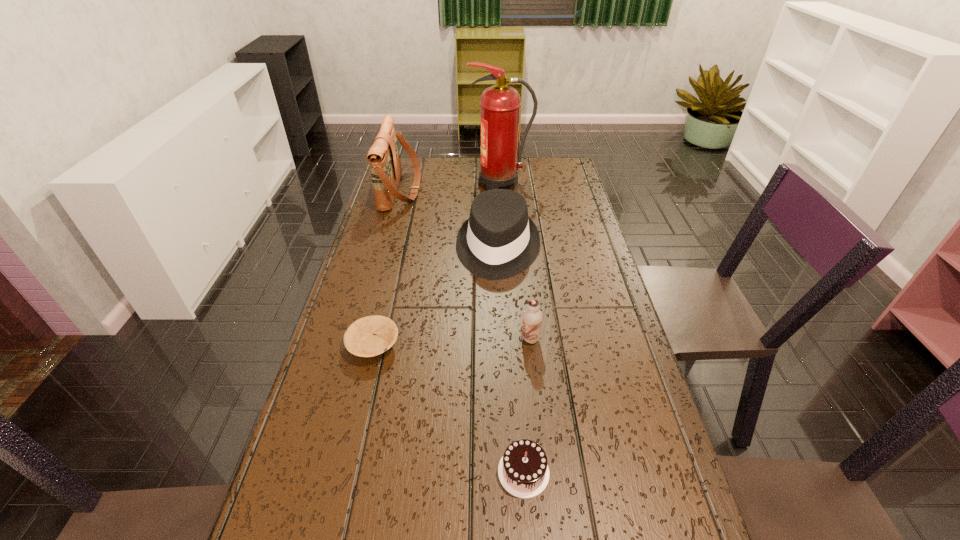
Identify the location of vacant area between the fourth shortest object and the shoulder bag. (449, 219).

Select which object is the closest to the third shortest object. Please provide its 2D coordinates. Your answer should be formatted as a tuple, i.e. [(x, y)], where the tuple contains the x and y coordinates of a point satisfying the conditions above.

[(498, 241)]

Select which object is the closest to the fourth nearest object. Please provide its 2D coordinates. Your answer should be formatted as a tuple, i.e. [(x, y)], where the tuple contains the x and y coordinates of a point satisfying the conditions above.

[(384, 158)]

At what (x,y) coordinates should I click in order to perform the action: click on free space that satisfies the following two spatial constraints: 1. on the front-facing side of the fifth shortest object; 2. on the left side of the fifth tallest object. Please return your answer as a coordinate pair (x, y). Looking at the image, I should click on (325, 472).

The image size is (960, 540). In order to click on free space that satisfies the following two spatial constraints: 1. on the back side of the fedora; 2. on the left side of the bowl in this screenshot , I will do `click(396, 248)`.

The height and width of the screenshot is (540, 960). Find the location of `free space that satisfies the following two spatial constraints: 1. on the back side of the bowl; 2. on the left side of the fourth tallest object`. free space that satisfies the following two spatial constraints: 1. on the back side of the bowl; 2. on the left side of the fourth tallest object is located at coordinates (374, 339).

In order to click on free location that satisfies the following two spatial constraints: 1. on the front-facing side of the shoulder bag; 2. on the right side of the nearest object in this screenshot , I will do `click(325, 472)`.

Locate an element on the screen. The image size is (960, 540). vacant space that satisfies the following two spatial constraints: 1. on the front side of the chocolate cake; 2. on the left side of the shortest object is located at coordinates (344, 472).

The height and width of the screenshot is (540, 960). Identify the location of blank area in the image that satisfies the following two spatial constraints: 1. on the front-facing side of the second tallest object; 2. on the right side of the shortest object. (360, 345).